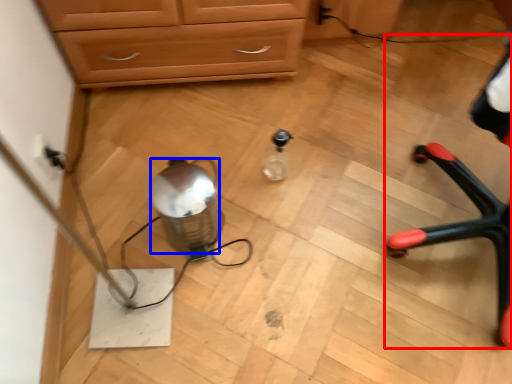
Question: Which point is further to the camera, armchair (highlighted by a red box) or water (highlighted by a blue box)?

Choices:
 (A) armchair
 (B) water

Answer: (B)